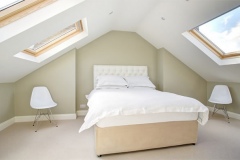
You are a GUI agent. You are given a task and a screenshot of the screen. Output one action in this format:
    pyautogui.click(x=<x>, y=<y>)
    Task: Click on the headboard
    
    Given the screenshot: What is the action you would take?
    pyautogui.click(x=128, y=75)